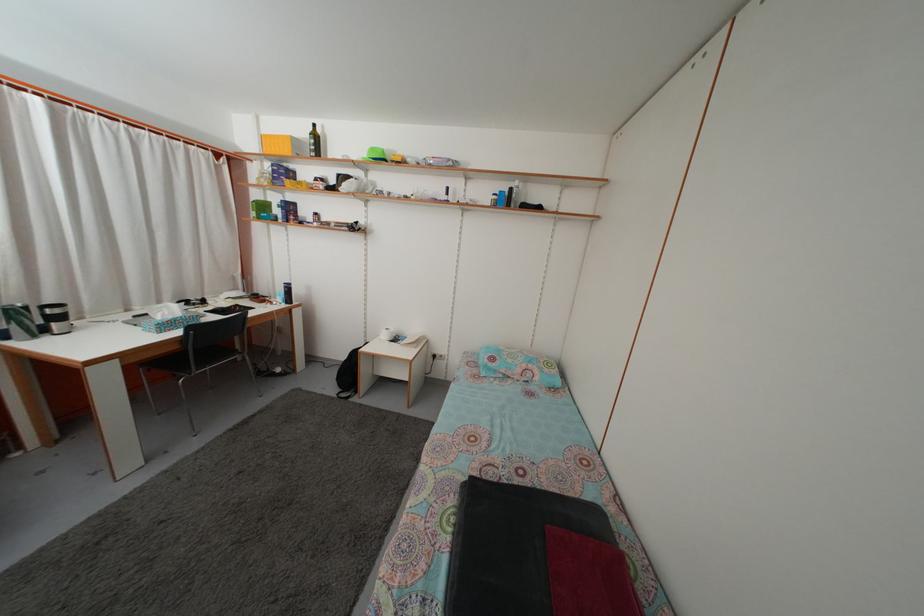
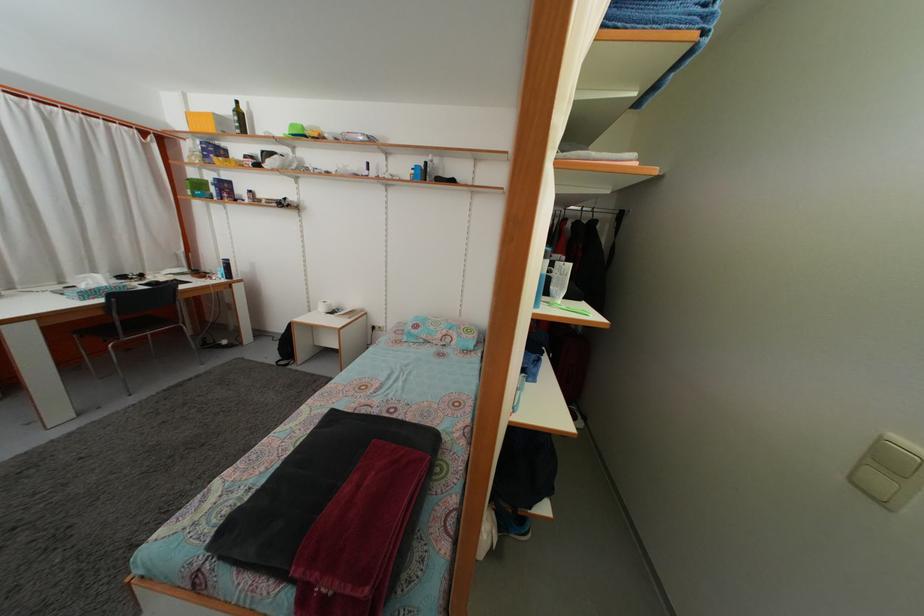
The point at [270,146] is marked in the first image. Where is the corresponding point in the second image?

(196, 123)